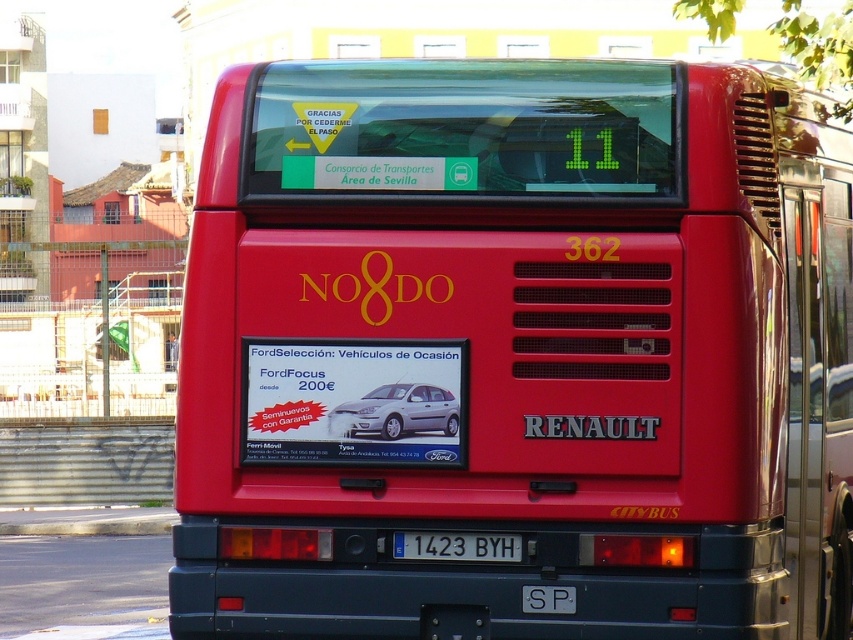
Question: Which object is farther from the camera taking this photo?

Choices:
 (A) satin silver metallic hatchback at center
 (B) metallic silver car at center

Answer: (A)

Question: Can you confirm if shiny red bus at center is positioned to the left of metallic silver car at center?

Choices:
 (A) no
 (B) yes

Answer: (B)

Question: Based on their relative distances, which object is nearer to the shiny red bus at center?

Choices:
 (A) white plastic license plate at center
 (B) metallic silver car at center
 (C) satin silver metallic hatchback at center

Answer: (B)

Question: Is the position of shiny red bus at center less distant than that of metallic silver car at center?

Choices:
 (A) no
 (B) yes

Answer: (A)

Question: Is shiny red bus at center above satin silver metallic hatchback at center?

Choices:
 (A) no
 (B) yes

Answer: (B)

Question: Which object appears closest to the camera in this image?

Choices:
 (A) metallic silver car at center
 (B) shiny red bus at center
 (C) satin silver metallic hatchback at center
 (D) white plastic license plate at center

Answer: (A)